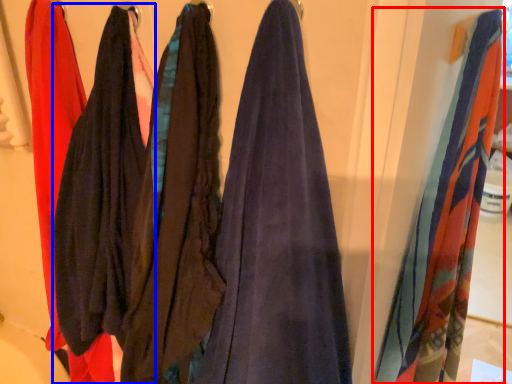
Question: Which object is further to the camera taking this photo, towel (highlighted by a red box) or clothing (highlighted by a blue box)?

Choices:
 (A) towel
 (B) clothing

Answer: (A)